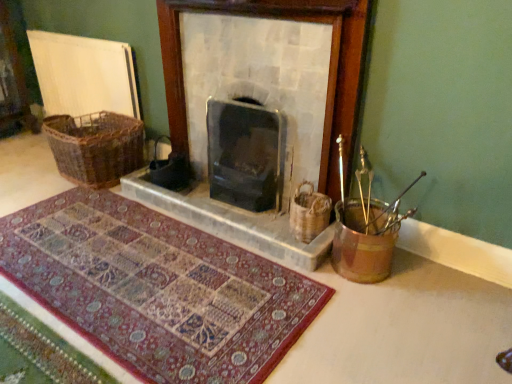
You are a GUI agent. You are given a task and a screenshot of the screen. Output one action in this format:
    pyautogui.click(x=<x>, y=<y>)
    Task: Click on the woven brown basket at left, the second basket viewed from the right
    This screenshot has height=384, width=512.
    Given the screenshot: What is the action you would take?
    pyautogui.click(x=95, y=147)

What do you see at coordinates (95, 147) in the screenshot?
I see `woven brown basket at left, which is the first basket from top to bottom` at bounding box center [95, 147].

You are a GUI agent. You are given a task and a screenshot of the screen. Output one action in this format:
    pyautogui.click(x=<x>, y=<y>)
    Task: Click on the woven brown basket at right, the second basket viewed from the top
    The width and height of the screenshot is (512, 384).
    Given the screenshot: What is the action you would take?
    pyautogui.click(x=309, y=213)

This screenshot has height=384, width=512. Find the location of `stone fireplace at center`. stone fireplace at center is located at coordinates (259, 108).

From the image's perspective, is woven brown basket at left, the first basket when ordered from back to front, under carpeted mat at center?

No, from the image's perspective, woven brown basket at left, the first basket when ordered from back to front, is not below carpeted mat at center.

Is woven brown basket at left, which is the first basket from top to bottom, placed right next to carpeted mat at center?

They are not placed beside each other.

Is woven brown basket at left, the first basket when ordered from back to front, bigger than carpeted mat at center?

Yes.

Considering the relative sizes of woven brown basket at left, the 1th basket when ordered from left to right, and metallic gold bucket at right in the image provided, is woven brown basket at left, the 1th basket when ordered from left to right, wider than metallic gold bucket at right?

Yes.

Is woven brown basket at left, which is the first basket from top to bottom, beside metallic gold bucket at right?

No.

Is woven brown basket at left, which is the first basket from top to bottom, to the right of metallic gold bucket at right from the viewer's perspective?

Incorrect, woven brown basket at left, which is the first basket from top to bottom, is not on the right side of metallic gold bucket at right.

Is woven brown basket at left, the first basket when ordered from back to front, positioned beyond the bounds of metallic gold bucket at right?

Yes, woven brown basket at left, the first basket when ordered from back to front, is located beyond the bounds of metallic gold bucket at right.

Who is taller, woven brown basket at right, marked as the first basket in a bottom-to-top arrangement, or stone fireplace at center?

Standing taller between the two is stone fireplace at center.

Who is more distant, woven brown basket at right, the second basket viewed from the top, or stone fireplace at center?

woven brown basket at right, the second basket viewed from the top, is behind.

From the image's perspective, which is above, woven brown basket at right, marked as the first basket in a bottom-to-top arrangement, or stone fireplace at center?

stone fireplace at center appears higher in the image.

Would you say woven brown basket at right, the second basket viewed from the top, is outside stone fireplace at center?

Indeed, woven brown basket at right, the second basket viewed from the top, is completely outside stone fireplace at center.

Where is `wood burning stove below the stone fireplace at center (from the image's perspective)`? The height and width of the screenshot is (384, 512). wood burning stove below the stone fireplace at center (from the image's perspective) is located at coordinates (245, 154).

Looking at this image, would you say stone fireplace at center is to the left or to the right of black glass wood burning stove at center in the picture?

In the image, stone fireplace at center appears on the left side of black glass wood burning stove at center.

Would you consider stone fireplace at center to be distant from black glass wood burning stove at center?

stone fireplace at center is near black glass wood burning stove at center, not far away.

Considering the sizes of stone fireplace at center and black glass wood burning stove at center in the image, is stone fireplace at center taller or shorter than black glass wood burning stove at center?

Considering their sizes, stone fireplace at center has more height than black glass wood burning stove at center.

This screenshot has width=512, height=384. I want to click on basket on the right side of stone fireplace at center, so click(x=309, y=213).

Considering the sizes of stone fireplace at center and woven brown basket at right, marked as the 1th basket in a front-to-back arrangement, in the image, is stone fireplace at center taller or shorter than woven brown basket at right, marked as the 1th basket in a front-to-back arrangement,?

In the image, stone fireplace at center appears to be taller than woven brown basket at right, marked as the 1th basket in a front-to-back arrangement.

Is stone fireplace at center aimed at woven brown basket at right, marked as the 1th basket in a front-to-back arrangement?

Yes, stone fireplace at center is aimed at woven brown basket at right, marked as the 1th basket in a front-to-back arrangement.

Is woven brown basket at right, marked as the first basket in a right-to-left arrangement, next to woven brown basket at left, marked as the second basket in a bottom-to-top arrangement, and touching it?

They are not placed beside each other.

Who is more distant, woven brown basket at right, the second basket viewed from the top, or woven brown basket at left, which is the first basket from top to bottom?

→ woven brown basket at left, which is the first basket from top to bottom, is further away from the camera.

Measure the distance between woven brown basket at right, the second basket when ordered from back to front, and woven brown basket at left, the second basket viewed from the right.

A distance of 4.32 feet exists between woven brown basket at right, the second basket when ordered from back to front, and woven brown basket at left, the second basket viewed from the right.

From the image's perspective, does woven brown basket at right, marked as the first basket in a right-to-left arrangement, appear lower than woven brown basket at left, the second basket viewed from the right?

Correct, woven brown basket at right, marked as the first basket in a right-to-left arrangement, appears lower than woven brown basket at left, the second basket viewed from the right, in the image.

How many degrees apart are the facing directions of carpeted mat at center and woven brown basket at left, marked as the second basket in a bottom-to-top arrangement?

3.21 degrees separate the facing orientations of carpeted mat at center and woven brown basket at left, marked as the second basket in a bottom-to-top arrangement.

Is carpeted mat at center taller or shorter than woven brown basket at left, marked as the second basket in a bottom-to-top arrangement?

carpeted mat at center is shorter than woven brown basket at left, marked as the second basket in a bottom-to-top arrangement.

Looking at the image, does carpeted mat at center seem bigger or smaller compared to woven brown basket at left, marked as the second basket in a front-to-back arrangement?

carpeted mat at center is smaller than woven brown basket at left, marked as the second basket in a front-to-back arrangement.

Is carpeted mat at center inside or outside of woven brown basket at left, marked as the second basket in a front-to-back arrangement?

carpeted mat at center cannot be found inside woven brown basket at left, marked as the second basket in a front-to-back arrangement.

You are a GUI agent. You are given a task and a screenshot of the screen. Output one action in this format:
    pyautogui.click(x=<x>, y=<y>)
    Task: Click on the mat that is in front of the woven brown basket at left, the 1th basket when ordered from left to right
    
    Given the screenshot: What is the action you would take?
    pyautogui.click(x=157, y=289)

Identify the location of basket container below the woven brown basket at left, marked as the second basket in a front-to-back arrangement (from a real-world perspective). (362, 245).

In the scene shown: Considering their positions, is black glass wood burning stove at center positioned closer to carpeted mat at center than stone fireplace at center?

stone fireplace at center is closer to carpeted mat at center.

Which object lies further to the anchor point black glass wood burning stove at center, stone fireplace at center or carpeted mat at center?

carpeted mat at center is further to black glass wood burning stove at center.

Estimate the real-world distances between objects in this image. Which object is closer to stone fireplace at center, woven brown basket at right, the second basket when ordered from back to front, or black glass wood burning stove at center?

black glass wood burning stove at center lies closer to stone fireplace at center than the other object.

Based on their spatial positions, is woven brown basket at right, the second basket positioned from the left, or black glass wood burning stove at center further from carpeted mat at center?

black glass wood burning stove at center is positioned further to the anchor carpeted mat at center.

Based on their spatial positions, is woven brown basket at right, marked as the first basket in a bottom-to-top arrangement, or black glass wood burning stove at center closer to metallic gold bucket at right?

woven brown basket at right, marked as the first basket in a bottom-to-top arrangement.

When comparing their distances from woven brown basket at left, the second basket viewed from the right, does metallic gold bucket at right or stone fireplace at center seem closer?

stone fireplace at center is positioned closer to the anchor woven brown basket at left, the second basket viewed from the right.

From the image, which object appears to be farther from metallic gold bucket at right, carpeted mat at center or black glass wood burning stove at center?

black glass wood burning stove at center lies further to metallic gold bucket at right than the other object.

Considering their positions, is black glass wood burning stove at center positioned further to stone fireplace at center than carpeted mat at center?

carpeted mat at center is positioned further to the anchor stone fireplace at center.

Image resolution: width=512 pixels, height=384 pixels. I want to click on fireplace between woven brown basket at left, marked as the second basket in a bottom-to-top arrangement, and woven brown basket at right, marked as the first basket in a bottom-to-top arrangement, so click(x=259, y=108).

Identify the location of wood burning stove between woven brown basket at left, which is the first basket from top to bottom, and woven brown basket at right, marked as the 1th basket in a front-to-back arrangement, in the horizontal direction. (245, 154).

The height and width of the screenshot is (384, 512). Identify the location of basket positioned between carpeted mat at center and black glass wood burning stove at center from near to far. [x=309, y=213].

Locate an element on the screen. Image resolution: width=512 pixels, height=384 pixels. wood burning stove located between carpeted mat at center and woven brown basket at left, the first basket when ordered from back to front, in the depth direction is located at coordinates (245, 154).